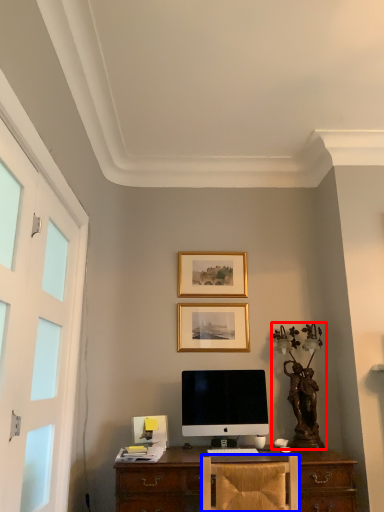
Question: Which object appears farthest to the camera in this image, antique (highlighted by a red box) or chair (highlighted by a blue box)?

Choices:
 (A) antique
 (B) chair

Answer: (A)